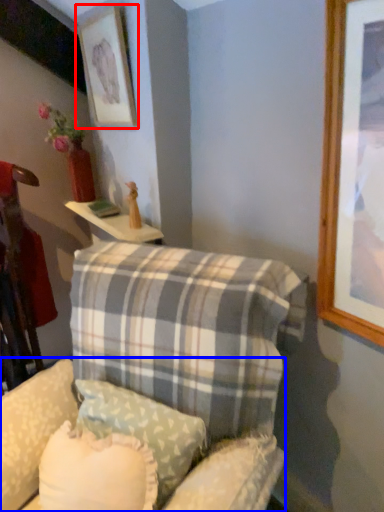
Question: Which of the following is the farthest to the observer, picture frame (highlighted by a red box) or swivel chair (highlighted by a blue box)?

Choices:
 (A) picture frame
 (B) swivel chair

Answer: (A)